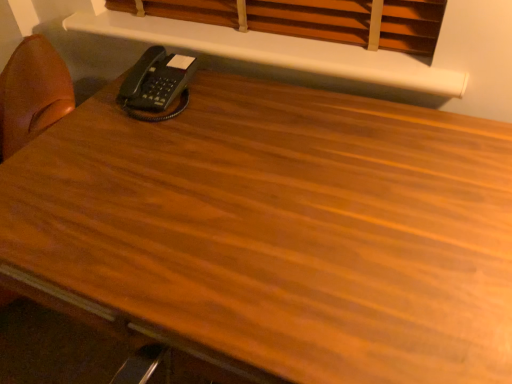
Find the location of `free area below black plastic phone at upper left (from a real-world perspective)`. free area below black plastic phone at upper left (from a real-world perspective) is located at coordinates (162, 99).